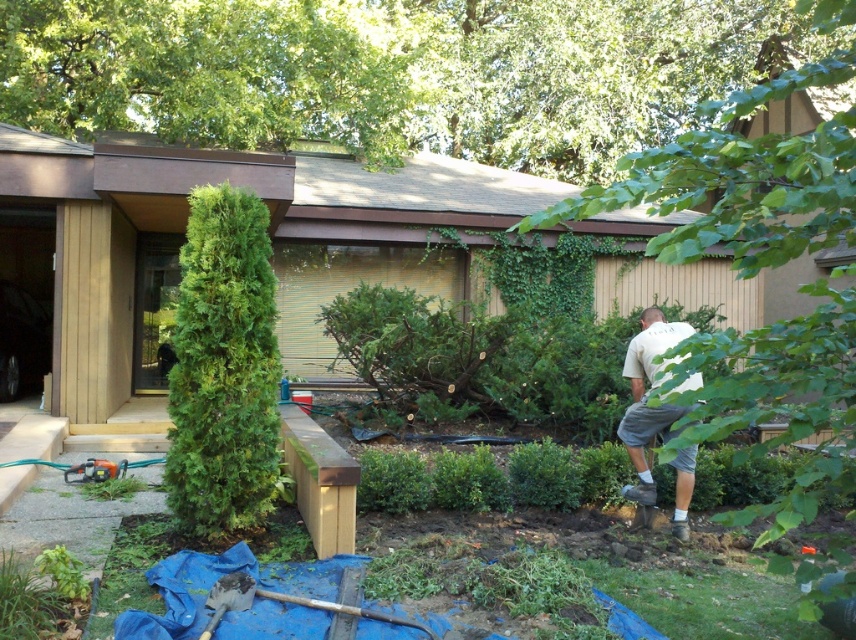
Question: Can you confirm if green leafy tree at center is smaller than white cotton shirt at lower right?

Choices:
 (A) yes
 (B) no

Answer: (B)

Question: Is green leafy tree at upper center above white cotton shirt at lower right?

Choices:
 (A) no
 (B) yes

Answer: (B)

Question: Can you confirm if green textured evergreen tree at left is smaller than white cotton shirt at lower right?

Choices:
 (A) no
 (B) yes

Answer: (B)

Question: Which point is farther to the camera?

Choices:
 (A) (681, 474)
 (B) (207, 276)
 (C) (3, 81)
 (D) (755, 348)

Answer: (C)

Question: Considering the real-world distances, which object is closest to the green leafy tree at center?

Choices:
 (A) green textured evergreen tree at left
 (B) white cotton shirt at lower right

Answer: (B)

Question: Which of the following is the farthest from the observer?

Choices:
 (A) green leafy tree at upper center
 (B) green leafy tree at center

Answer: (A)